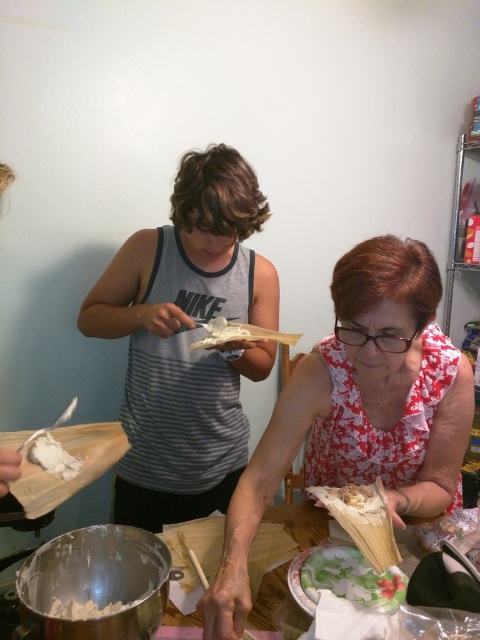
The height and width of the screenshot is (640, 480). I want to click on gray striped tank top at center, so click(x=187, y=340).

The width and height of the screenshot is (480, 640). I want to click on gray striped tank top at center, so click(187, 340).

Looking at this image, does gray striped tank top at center appear over floral printed blouse at center?

Indeed, gray striped tank top at center is positioned over floral printed blouse at center.

Who is lower down, gray striped tank top at center or floral printed blouse at center?

floral printed blouse at center

Between point (210, 253) and point (386, 305), which one is positioned behind?

Positioned behind is point (210, 253).

This screenshot has width=480, height=640. I want to click on gray striped tank top at center, so click(187, 340).

Between white fluffy dough at lower left and wooden table at center, which one has less height?

Standing shorter between the two is white fluffy dough at lower left.

Can you confirm if white fluffy dough at lower left is shorter than wooden table at center?

Yes.

Locate an element on the screen. The width and height of the screenshot is (480, 640). white fluffy dough at lower left is located at coordinates (51, 454).